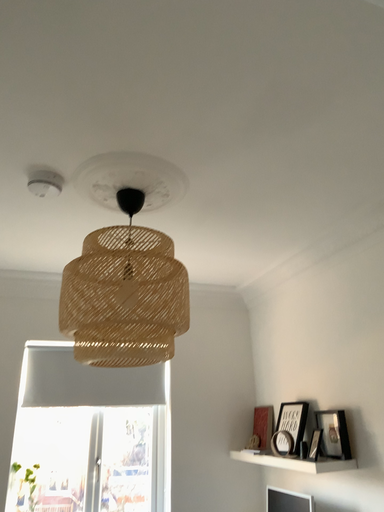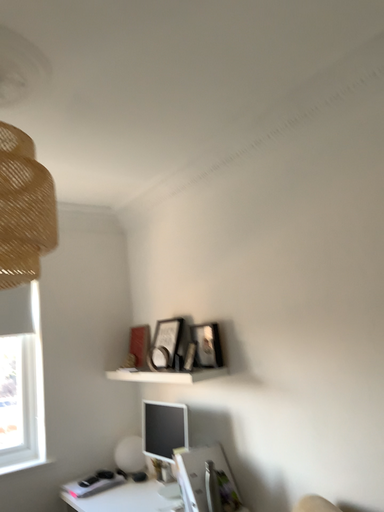
Question: Which way did the camera rotate in the video?

Choices:
 (A) rotated left
 (B) rotated right

Answer: (B)